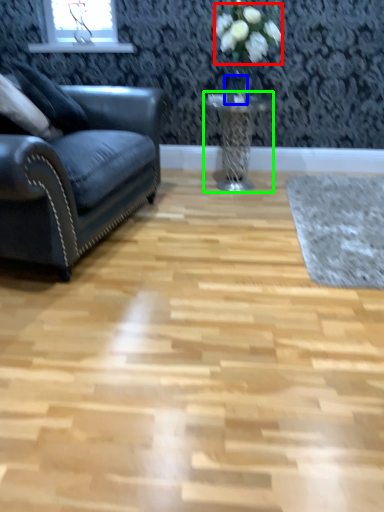
Question: Estimate the real-world distances between objects in this image. Which object is farther from flower (highlighted by a red box), glass vase (highlighted by a blue box) or table (highlighted by a green box)?

Choices:
 (A) glass vase
 (B) table

Answer: (B)